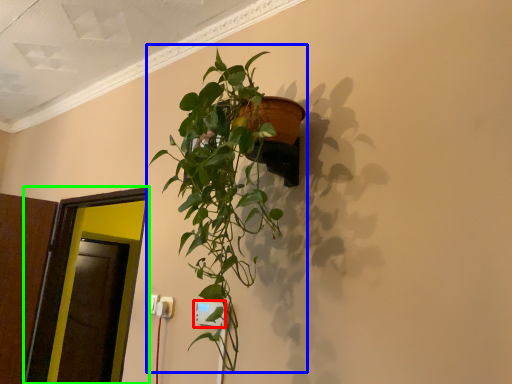
Question: Which object is positioned farthest from electric outlet (highlighted by a red box)? Select from houseplant (highlighted by a blue box) and glass door (highlighted by a green box).

Choices:
 (A) houseplant
 (B) glass door

Answer: (B)